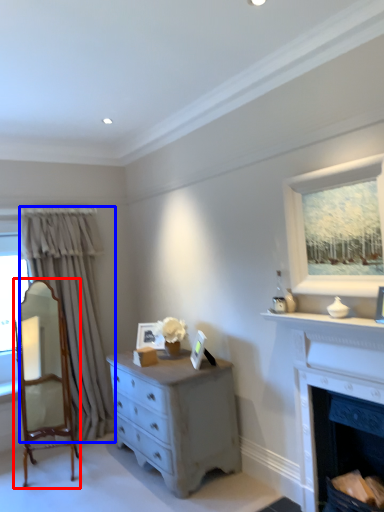
Question: Which object is closer to the camera taking this photo, armchair (highlighted by a red box) or curtain (highlighted by a blue box)?

Choices:
 (A) armchair
 (B) curtain

Answer: (A)